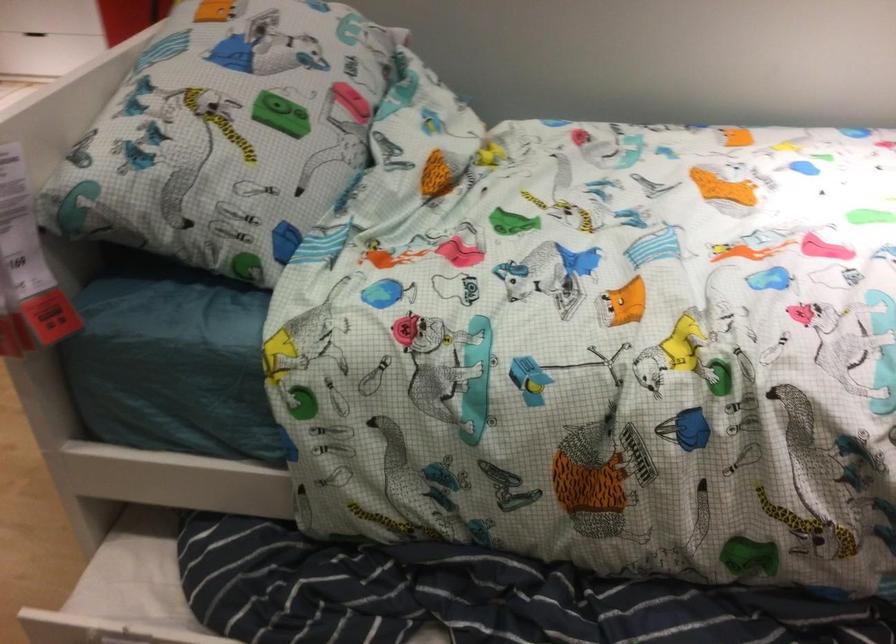
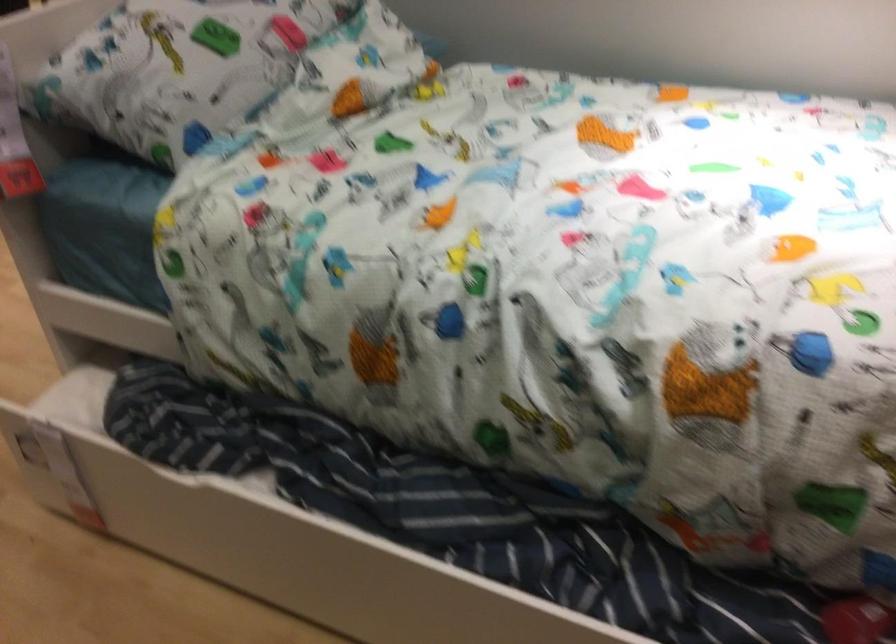
Locate, in the second image, the point that corresponds to [237,144] in the first image.

(177, 62)